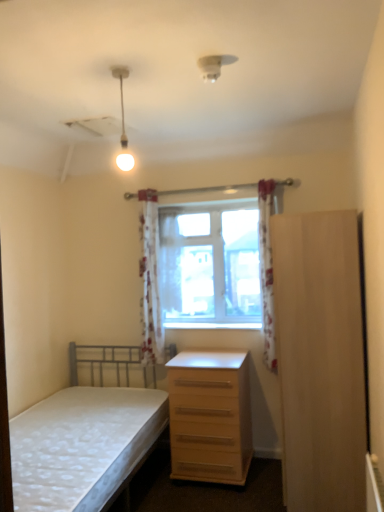
Question: From the image's perspective, relative to white floral fabric curtain at center, which ranks as the second curtain in right-to-left order, is light wood/file cabinet at right above or below?

Choices:
 (A) below
 (B) above

Answer: (A)

Question: Considering their positions, is light wood/file cabinet at right located in front of or behind white floral fabric curtain at center, marked as the 3th curtain in a front-to-back arrangement?

Choices:
 (A) behind
 (B) front

Answer: (B)

Question: Which is farther from the light wood/wooden chest of drawers at lower right?

Choices:
 (A) clear glass window at center
 (B) light wood/file cabinet at right
 (C) white floral fabric curtain at center, which is the 1th curtain in back-to-front order
 (D) white floral fabric curtain at right, the 3th curtain from the left
 (E) white fabric bed at lower left

Answer: (C)

Question: Which object is the closest to the light wood/wooden chest of drawers at lower right?

Choices:
 (A) white floral fabric curtain at center, marked as the 3th curtain in a front-to-back arrangement
 (B) light wood/file cabinet at right
 (C) matte white bulb at upper center
 (D) wooden at center
 (E) white fabric bed at lower left

Answer: (E)